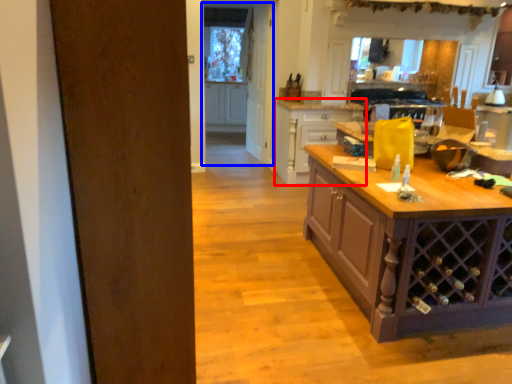
Question: Which of the following is the closest to the observer, cabinetry (highlighted by a red box) or glass door (highlighted by a blue box)?

Choices:
 (A) cabinetry
 (B) glass door

Answer: (A)